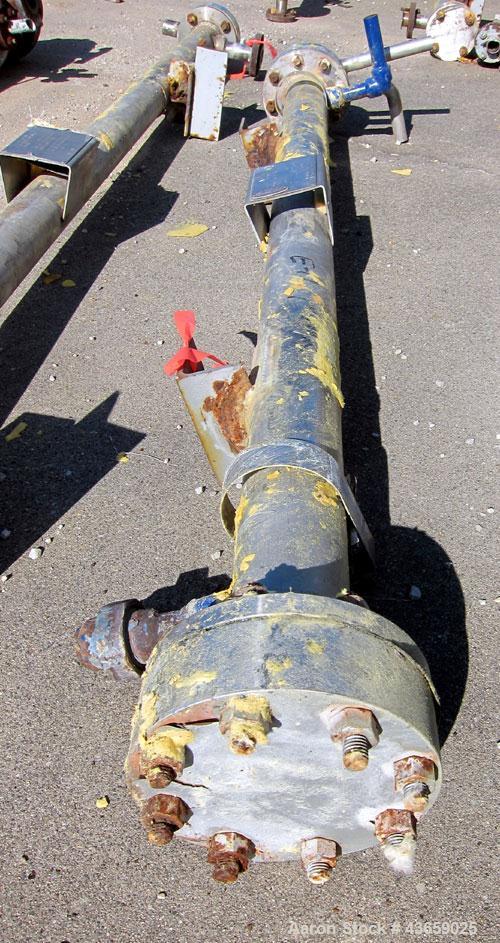
The image size is (500, 943). What are the coordinates of `sandy flooring` in the screenshot? It's located at (51, 721), (53, 790), (90, 864), (451, 836), (459, 521), (147, 546).